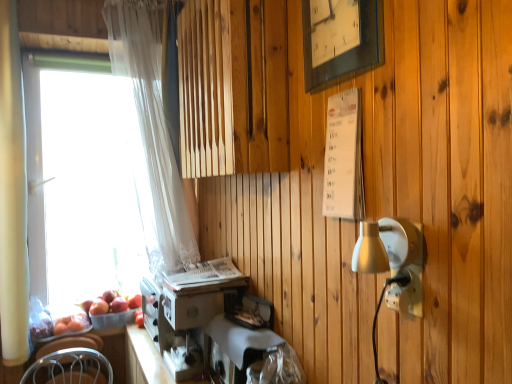
Question: From a real-world perspective, does wooden frame clock at upper center sit lower than white sheer curtain at left, the second curtain positioned from the left?

Choices:
 (A) no
 (B) yes

Answer: (A)

Question: Considering the relative sizes of wooden frame clock at upper center and white sheer curtain at left, the second curtain when ordered from front to back, in the image provided, is wooden frame clock at upper center wider than white sheer curtain at left, the second curtain when ordered from front to back,?

Choices:
 (A) yes
 (B) no

Answer: (B)

Question: From the image's perspective, does wooden frame clock at upper center appear higher than white sheer curtain at left, the second curtain when ordered from front to back?

Choices:
 (A) no
 (B) yes

Answer: (B)

Question: Is wooden frame clock at upper center shorter than white sheer curtain at left, the first curtain positioned from the right?

Choices:
 (A) yes
 (B) no

Answer: (A)

Question: Considering the relative sizes of wooden frame clock at upper center and white sheer curtain at left, the second curtain positioned from the left, in the image provided, is wooden frame clock at upper center thinner than white sheer curtain at left, the second curtain positioned from the left,?

Choices:
 (A) no
 (B) yes

Answer: (B)

Question: Is wooden frame clock at upper center bigger than white sheer curtain at left, the first curtain positioned from the right?

Choices:
 (A) no
 (B) yes

Answer: (A)

Question: Is translucent plastic basket at lower left shorter than white sheer curtain at left, the 1th curtain viewed from the back?

Choices:
 (A) no
 (B) yes

Answer: (B)

Question: Does translucent plastic basket at lower left lie in front of white sheer curtain at left, the second curtain positioned from the left?

Choices:
 (A) yes
 (B) no

Answer: (B)

Question: From the image's perspective, does translucent plastic basket at lower left appear lower than white sheer curtain at left, the 1th curtain viewed from the back?

Choices:
 (A) no
 (B) yes

Answer: (B)

Question: Is translucent plastic basket at lower left to the right of white sheer curtain at left, the second curtain positioned from the left, from the viewer's perspective?

Choices:
 (A) yes
 (B) no

Answer: (B)

Question: Is translucent plastic basket at lower left touching white sheer curtain at left, the 1th curtain viewed from the back?

Choices:
 (A) no
 (B) yes

Answer: (A)

Question: Does translucent plastic basket at lower left have a greater width compared to white sheer curtain at left, the first curtain positioned from the right?

Choices:
 (A) yes
 (B) no

Answer: (B)

Question: Considering the relative sizes of white sheer curtain at left, the second curtain when ordered from front to back, and white fabric-covered sewing machine at lower center in the image provided, is white sheer curtain at left, the second curtain when ordered from front to back, thinner than white fabric-covered sewing machine at lower center?

Choices:
 (A) yes
 (B) no

Answer: (B)